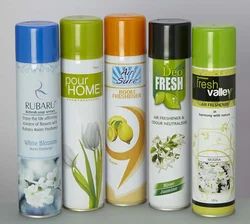
This screenshot has width=250, height=224. I want to click on air freshener spray, so click(x=39, y=107), click(x=84, y=125), click(x=121, y=116), click(x=163, y=111), click(x=224, y=129).